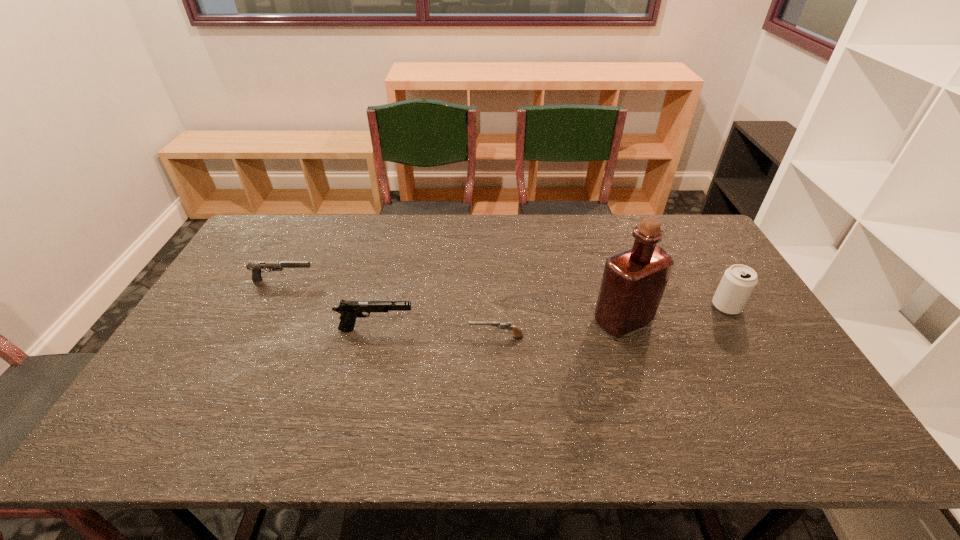
I want to click on vacant space located 0.350m on the back of the liquor, so click(x=594, y=233).

What are the coordinates of `free space located 0.220m on the front of the second tallest object` in the screenshot? It's located at (771, 381).

Where is `free space located 0.230m at the aiming end of the third shortest object`? Image resolution: width=960 pixels, height=540 pixels. free space located 0.230m at the aiming end of the third shortest object is located at coordinates (496, 330).

Where is `vacant area situated at the muzzle end of the farthest object`? Image resolution: width=960 pixels, height=540 pixels. vacant area situated at the muzzle end of the farthest object is located at coordinates (333, 280).

The height and width of the screenshot is (540, 960). Find the location of `vacant space positioned 0.280m aiming along the barrel of the third object from left to right`. vacant space positioned 0.280m aiming along the barrel of the third object from left to right is located at coordinates (367, 337).

You are a GUI agent. You are given a task and a screenshot of the screen. Output one action in this format:
    pyautogui.click(x=<x>, y=<y>)
    Task: Click on the free space located 0.400m aiming along the barrel of the third object from left to right
    The image size is (960, 540).
    Given the screenshot: What is the action you would take?
    pyautogui.click(x=324, y=337)

The height and width of the screenshot is (540, 960). Find the location of `vacant space located 0.050m aiming along the barrel of the third object from left to right`. vacant space located 0.050m aiming along the barrel of the third object from left to right is located at coordinates [451, 337].

The height and width of the screenshot is (540, 960). I want to click on object located in the left edge section of the desktop, so click(x=255, y=267).

You are a GUI agent. You are given a task and a screenshot of the screen. Output one action in this format:
    pyautogui.click(x=<x>, y=<y>)
    Task: Click on the object that is at the right edge
    The image size is (960, 540).
    Given the screenshot: What is the action you would take?
    pyautogui.click(x=739, y=281)

Locate an element on the screen. This screenshot has height=540, width=960. vacant position at the far edge of the desktop is located at coordinates (355, 247).